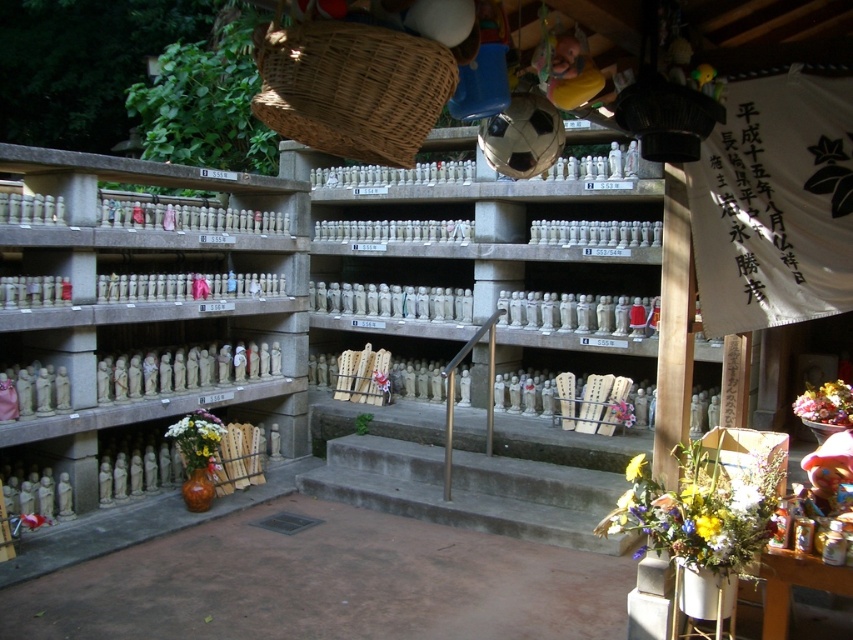
Does woven brown basket at upper center appear under yellow fabric flower at center?

No, woven brown basket at upper center is not below yellow fabric flower at center.

Is point (334, 36) positioned in front of point (631, 412)?

Yes.

Who is more distant from viewer, (395,40) or (616,404)?

Point (616,404)

Find the location of a particular element. This screenshot has width=853, height=640. woven brown basket at upper center is located at coordinates (352, 88).

Which of these two, woven brown basket at upper center or white floral bouquet at lower left, stands taller?

With more height is white floral bouquet at lower left.

The width and height of the screenshot is (853, 640). What are the coordinates of `woven brown basket at upper center` in the screenshot? It's located at (352, 88).

This screenshot has height=640, width=853. I want to click on woven brown basket at upper center, so click(352, 88).

Can you confirm if white floral bouquet at lower left is thinner than fluffy bouquet at lower right?

No, white floral bouquet at lower left is not thinner than fluffy bouquet at lower right.

Is white floral bouquet at lower left positioned in front of fluffy bouquet at lower right?

No, it is not.

Which is behind, point (206, 412) or point (844, 404)?

Positioned behind is point (206, 412).

Identify the location of white floral bouquet at lower left. This screenshot has height=640, width=853. (196, 440).